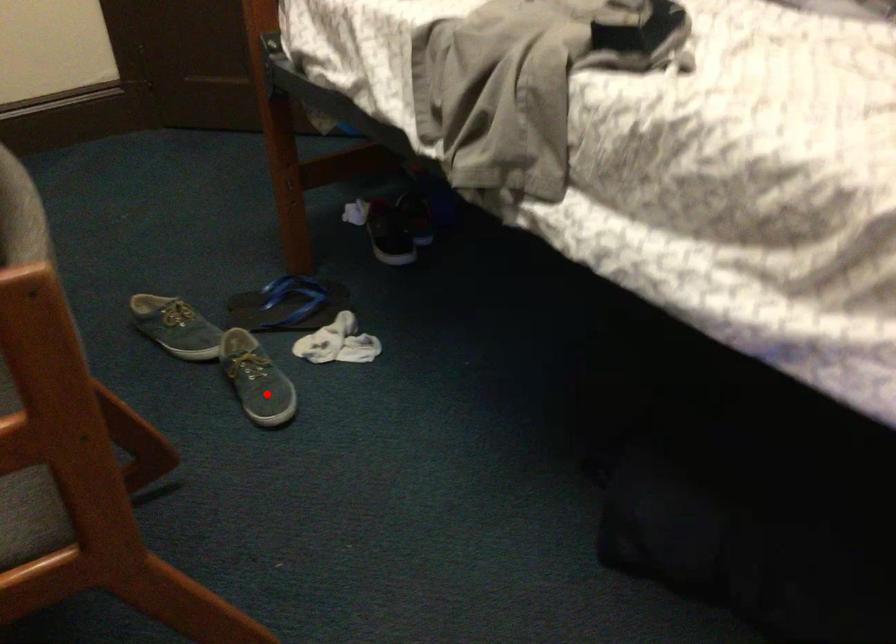
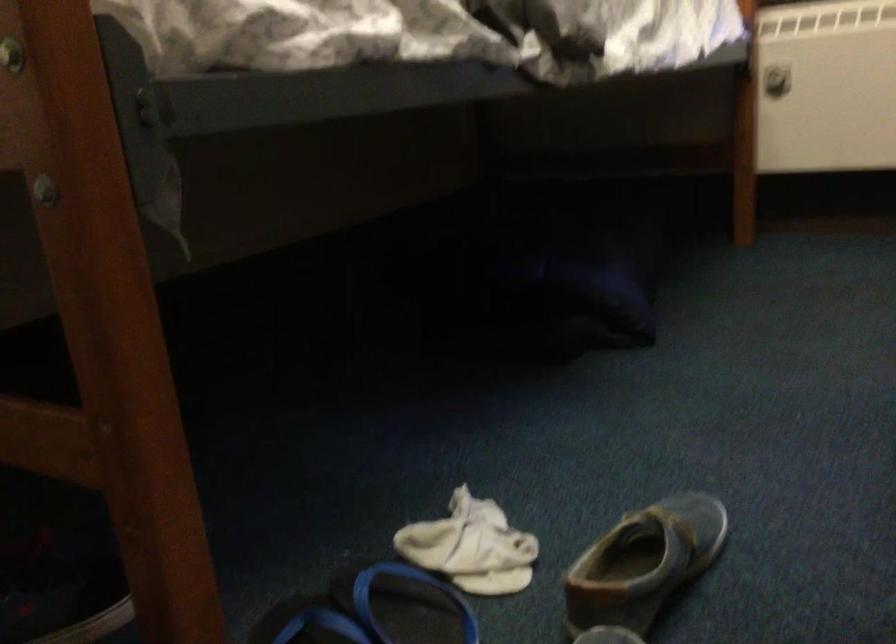
In the second image, find the point that corresponds to the highlighted location in the first image.

(643, 563)